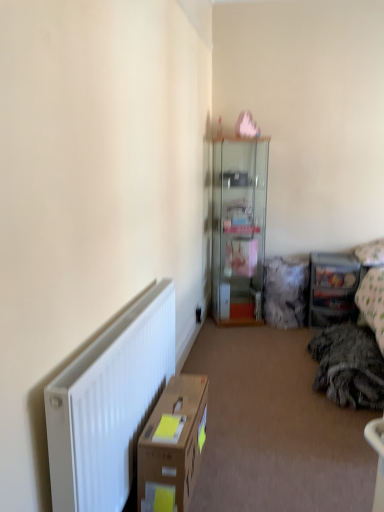
Question: Is brown cardboard box at lower left wider or thinner than transparent glass cabinet at upper center?

Choices:
 (A) wide
 (B) thin

Answer: (B)

Question: Considering their positions, is brown cardboard box at lower left located in front of or behind transparent glass cabinet at upper center?

Choices:
 (A) behind
 (B) front

Answer: (B)

Question: Which object is the closest to the brown cardboard box at lower left?

Choices:
 (A) fluffy white pillow at upper right
 (B) clear plastic storage at right
 (C) transparent glass cabinet at upper center
 (D) white matte radiator at lower left

Answer: (D)

Question: Considering the real-world distances, which object is closest to the clear plastic storage at right?

Choices:
 (A) transparent glass cabinet at upper center
 (B) fluffy white pillow at upper right
 (C) white matte radiator at lower left
 (D) brown cardboard box at lower left

Answer: (B)